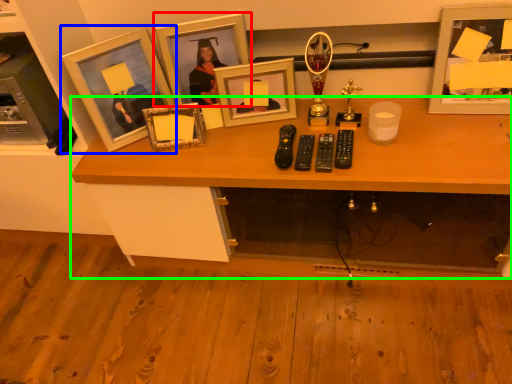
Question: Which is farther away from picture frame (highlighted by a red box)? picture frame (highlighted by a blue box) or desk (highlighted by a green box)?

Choices:
 (A) picture frame
 (B) desk

Answer: (B)